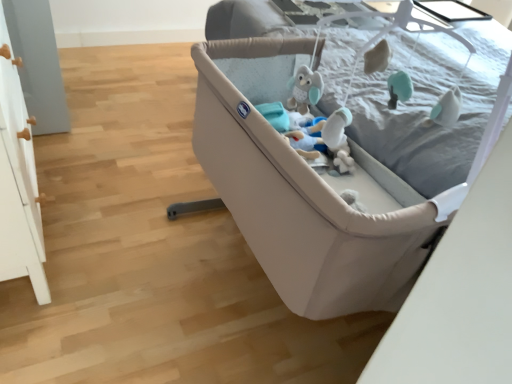
At what (x,y) coordinates should I click in order to perform the action: click on free region under beige fabric crib at center (from a real-world perspective). Please return your answer as a coordinate pair (x, y). This screenshot has height=384, width=512. Looking at the image, I should click on (254, 296).